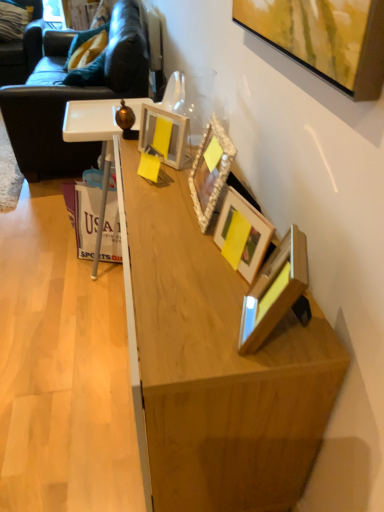
Locate an element on the screen. free space in front of silver textured picture frame at upper right, the second picture frame in the back-to-front sequence is located at coordinates (188, 249).